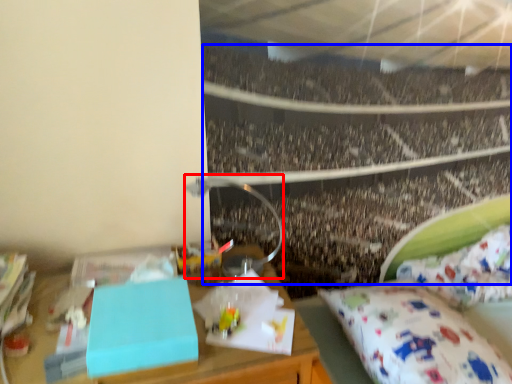
Question: Which point is further to the camera, lamp (highlighted by a red box) or crowd (highlighted by a blue box)?

Choices:
 (A) lamp
 (B) crowd

Answer: (B)